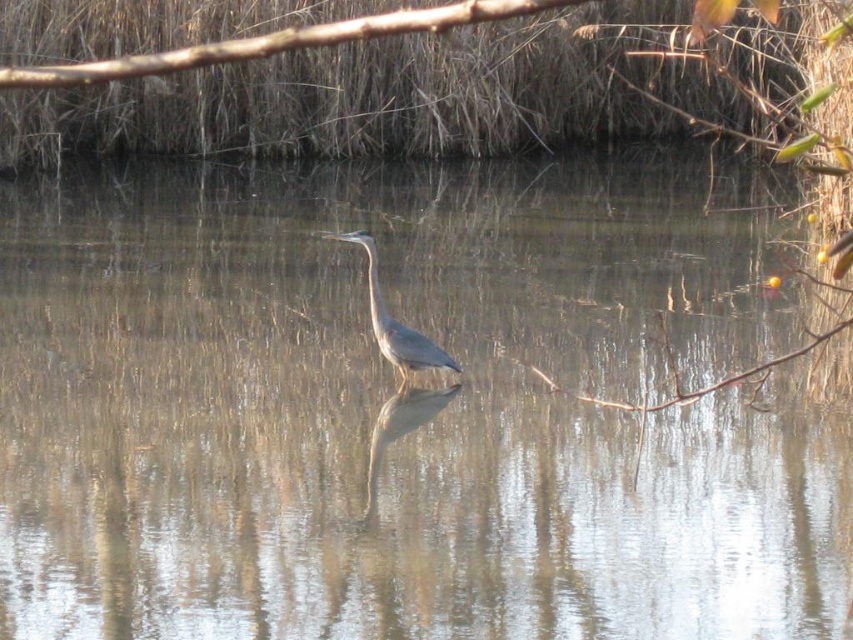
Question: Is brown rough branch at upper center positioned at the back of blue glossy heron at center?

Choices:
 (A) yes
 (B) no

Answer: (B)

Question: Which object is the farthest from the brown rough branch at upper center?

Choices:
 (A) blue glossy heron at center
 (B) gray matte bird at center

Answer: (A)

Question: Based on their relative distances, which object is farther from the brown rough branch at upper center?

Choices:
 (A) gray matte bird at center
 (B) blue glossy heron at center

Answer: (B)

Question: Is brown rough branch at upper center to the left of blue glossy heron at center from the viewer's perspective?

Choices:
 (A) yes
 (B) no

Answer: (A)

Question: Which object is the closest to the brown rough branch at upper center?

Choices:
 (A) gray matte bird at center
 (B) blue glossy heron at center

Answer: (A)

Question: Does gray matte bird at center appear on the left side of blue glossy heron at center?

Choices:
 (A) yes
 (B) no

Answer: (A)